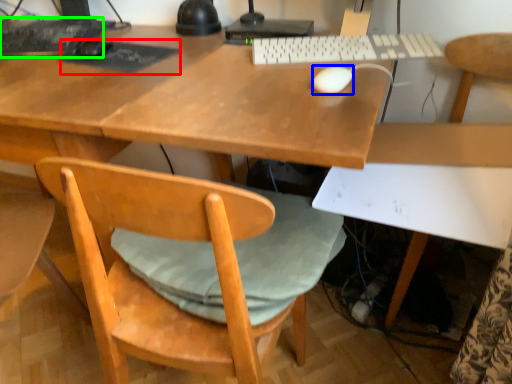
Question: Which object is the closest to the mousepad (highlighted by a red box)? Choose among these: mouse (highlighted by a blue box) or computer keyboard (highlighted by a green box).

Choices:
 (A) mouse
 (B) computer keyboard

Answer: (B)